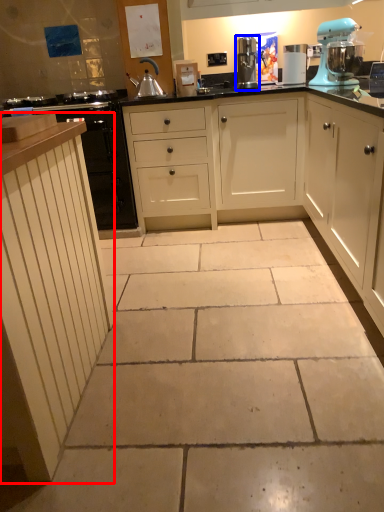
Question: Which object appears closest to the camera in this image, cabinetry (highlighted by a red box) or kitchen appliance (highlighted by a blue box)?

Choices:
 (A) cabinetry
 (B) kitchen appliance

Answer: (A)